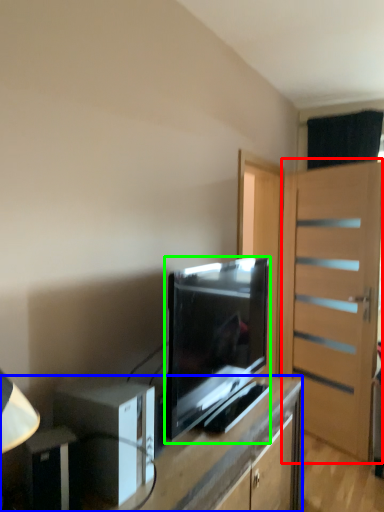
Question: Considering the real-world distances, which object is farthest from door (highlighted by a red box)? desk (highlighted by a blue box) or television (highlighted by a green box)?

Choices:
 (A) desk
 (B) television

Answer: (A)